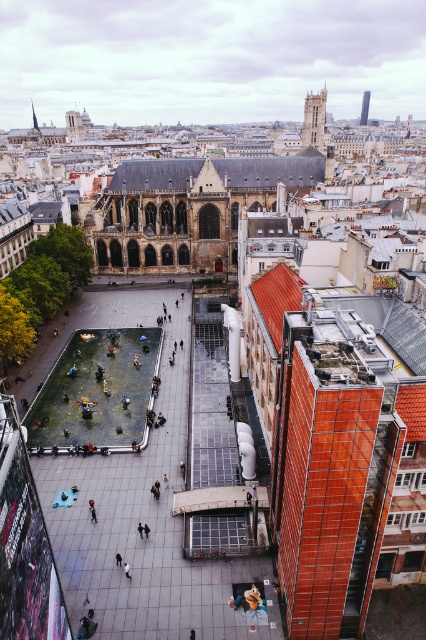
You are a city planner analyzing the urban layout. Given the gray slate roof at center and the smooth glass tower at upper center, which structure has a greater horizontal extent when viewed from above?

The gray slate roof at center has a greater horizontal extent than the smooth glass tower at upper center because its width surpasses the tower.